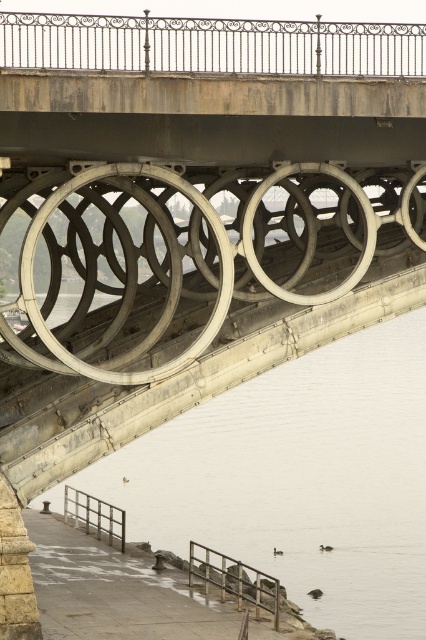
Is point (193, 552) farther from viewer compared to point (91, 525)?

No, it is in front of (91, 525).

Is metal/rustic rail at lower center below metallic gray railing at lower left?

Yes.

You are a GUI agent. You are given a task and a screenshot of the screen. Output one action in this format:
    pyautogui.click(x=<x>, y=<y>)
    Task: Click on the metal/rustic rail at lower center
    
    Given the screenshot: What is the action you would take?
    pyautogui.click(x=235, y=579)

You are a GUI agent. You are given a task and a screenshot of the screen. Output one action in this format:
    pyautogui.click(x=<x>, y=<y>)
    Task: Click on the metal/rustic rail at lower center
    The width and height of the screenshot is (426, 640).
    Given the screenshot: What is the action you would take?
    pyautogui.click(x=235, y=579)

Can you confirm if white smooth water at lower center is bigger than metal/rustic rail at lower center?

Yes.

Who is positioned more to the right, white smooth water at lower center or metal/rustic rail at lower center?

From the viewer's perspective, white smooth water at lower center appears more on the right side.

Locate an element on the screen. The width and height of the screenshot is (426, 640). white smooth water at lower center is located at coordinates (301, 480).

Find the location of a particular element. white smooth water at lower center is located at coordinates (301, 480).

Who is more distant from viewer, (339, 566) or (115, 536)?

Point (339, 566)

I want to click on white smooth water at lower center, so click(301, 480).